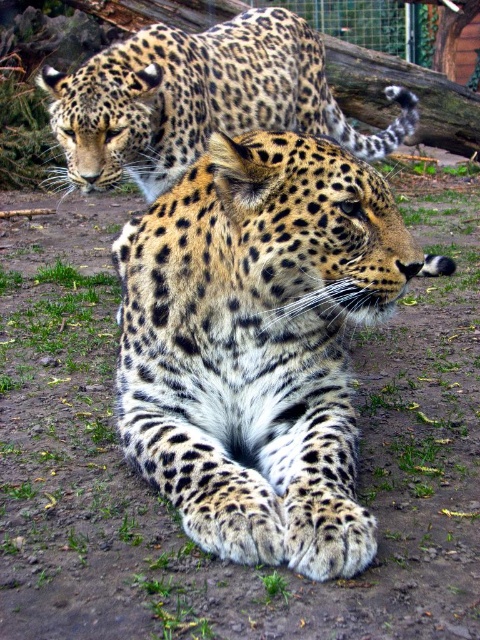
Is point (242, 269) closer to camera compared to point (291, 20)?

Yes.

Is spotted fur cheetah at center to the left of spotted fur leopard at upper center from the viewer's perspective?

No, spotted fur cheetah at center is not to the left of spotted fur leopard at upper center.

This screenshot has height=640, width=480. What are the coordinates of `spotted fur cheetah at center` in the screenshot? It's located at (x=257, y=344).